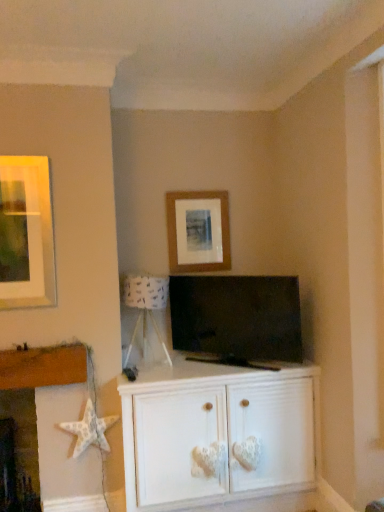
At what (x,y) coordinates should I click in order to perform the action: click on vacant region above white textured star at lower left (from a real-world perspective). Please return your answer as a coordinate pair (x, y). Looking at the image, I should click on (66, 334).